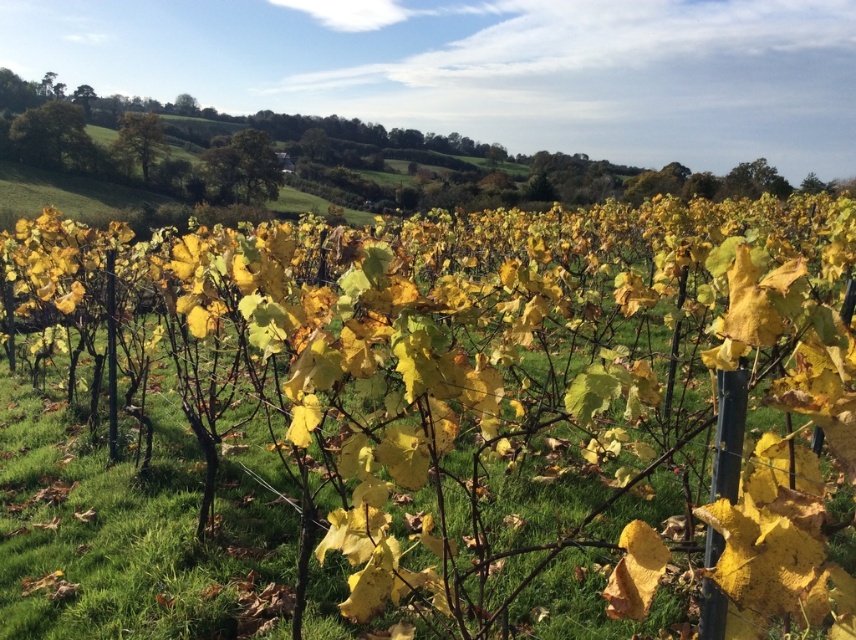
You are standing at the base of the vineyard looking towards the hills. You notice two green leafy trees in the distance. Which tree, the green leafy tree at upper left or the green leafy tree at upper right, appears taller from your vantage point?

The green leafy tree at upper right appears taller because it has a greater height compared to the green leafy tree at upper left.